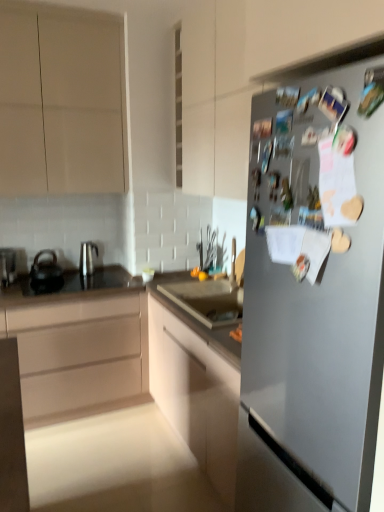
Question: Is black glass countertop at center at the right side of matte beige cabinet at left, placed as the second cabinetry when sorted from bottom to top?

Choices:
 (A) no
 (B) yes

Answer: (B)

Question: From the image's perspective, is black glass countertop at center on top of matte beige cabinet at left, placed as the second cabinetry when sorted from bottom to top?

Choices:
 (A) no
 (B) yes

Answer: (B)

Question: Does black glass countertop at center have a lesser height compared to matte beige cabinet at left, placed as the second cabinetry when sorted from bottom to top?

Choices:
 (A) no
 (B) yes

Answer: (B)

Question: Considering the relative sizes of black glass countertop at center and matte beige cabinet at left, marked as the 2th cabinetry in a top-to-bottom arrangement, in the image provided, is black glass countertop at center bigger than matte beige cabinet at left, marked as the 2th cabinetry in a top-to-bottom arrangement,?

Choices:
 (A) yes
 (B) no

Answer: (B)

Question: Is black glass countertop at center positioned before matte beige cabinet at left, placed as the second cabinetry when sorted from bottom to top?

Choices:
 (A) no
 (B) yes

Answer: (A)

Question: Considering the relative sizes of black glass countertop at center and matte beige cabinet at left, placed as the second cabinetry when sorted from bottom to top, in the image provided, is black glass countertop at center taller than matte beige cabinet at left, placed as the second cabinetry when sorted from bottom to top,?

Choices:
 (A) no
 (B) yes

Answer: (A)

Question: Considering the relative positions of black glass countertop at center and metallic silver kettle at left in the image provided, is black glass countertop at center to the left of metallic silver kettle at left from the viewer's perspective?

Choices:
 (A) yes
 (B) no

Answer: (B)

Question: Is black glass countertop at center wider than metallic silver kettle at left?

Choices:
 (A) yes
 (B) no

Answer: (A)

Question: Is black glass countertop at center facing towards metallic silver kettle at left?

Choices:
 (A) yes
 (B) no

Answer: (B)

Question: Considering the relative positions of black glass countertop at center and metallic silver kettle at left in the image provided, is black glass countertop at center in front of metallic silver kettle at left?

Choices:
 (A) no
 (B) yes

Answer: (B)

Question: Can you confirm if black glass countertop at center is taller than metallic silver kettle at left?

Choices:
 (A) yes
 (B) no

Answer: (B)

Question: From the image's perspective, does black glass countertop at center appear lower than metallic silver kettle at left?

Choices:
 (A) no
 (B) yes

Answer: (B)

Question: Would you say black glass countertop at center is part of black matte tea pot at left, acting as the first tea pot starting from the left,'s contents?

Choices:
 (A) yes
 (B) no

Answer: (B)